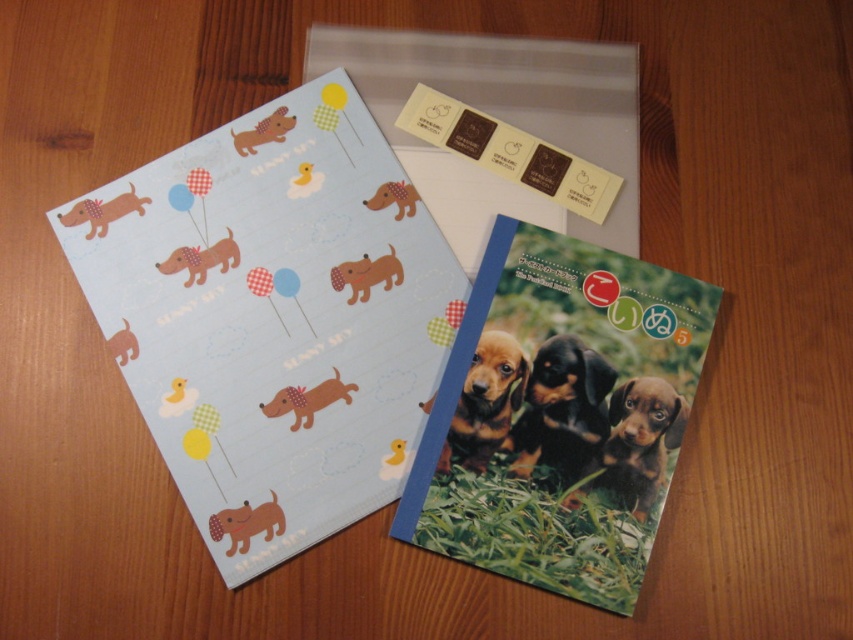
Question: Can you confirm if brown glossy dog at center is positioned to the left of matte brown dog at lower left?

Choices:
 (A) no
 (B) yes

Answer: (A)

Question: Which object is closer to the camera taking this photo?

Choices:
 (A) printed paper postcard at center
 (B) matte brown dog at lower left
 (C) black and tan fur puppies at center

Answer: (A)

Question: Which point appears closest to the camera in this image?

Choices:
 (A) (663, 381)
 (B) (503, 346)
 (C) (624, 564)

Answer: (C)

Question: Can you confirm if printed paper postcard at center is positioned to the left of brown fur puppy at center?

Choices:
 (A) no
 (B) yes

Answer: (B)

Question: Which point is closer to the camera taking this photo?

Choices:
 (A) tap(474, 397)
 (B) tap(642, 404)

Answer: (A)

Question: From the image, what is the correct spatial relationship of matte paper postcard at upper left in relation to black and tan fur puppies at center?

Choices:
 (A) left
 (B) right

Answer: (A)